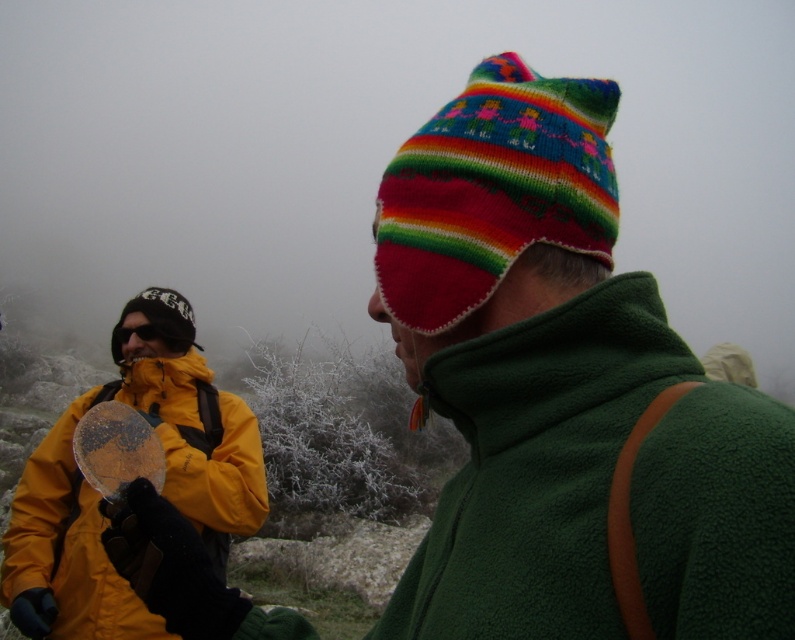
You are standing in the cold foggy environment shown in the image. You see two points marked in the scene. The first point is at coordinate point (592, 538) and the second is at coordinate point (208, 371). Which point is closer to you?

Point (592, 538) is closer to the viewer than point (208, 371).

You are trying to decide which jacket to wear for a hike. You need a jacket that reaches your hips. Based on the image, which jacket between the green fleece jacket at right and the yellow fleece jacket at left would you choose?

The yellow fleece jacket at left is taller than the green fleece jacket at right, so it would reach your hips better.

Looking at this image, you are trying to decide which jacket to wear for a cold day. Both the green fleece jacket at right and the yellow fleece jacket at left are available. Based on their sizes, which one might provide more warmth?

The yellow fleece jacket at left is larger than the green fleece jacket at right, so it might provide more warmth due to its size.